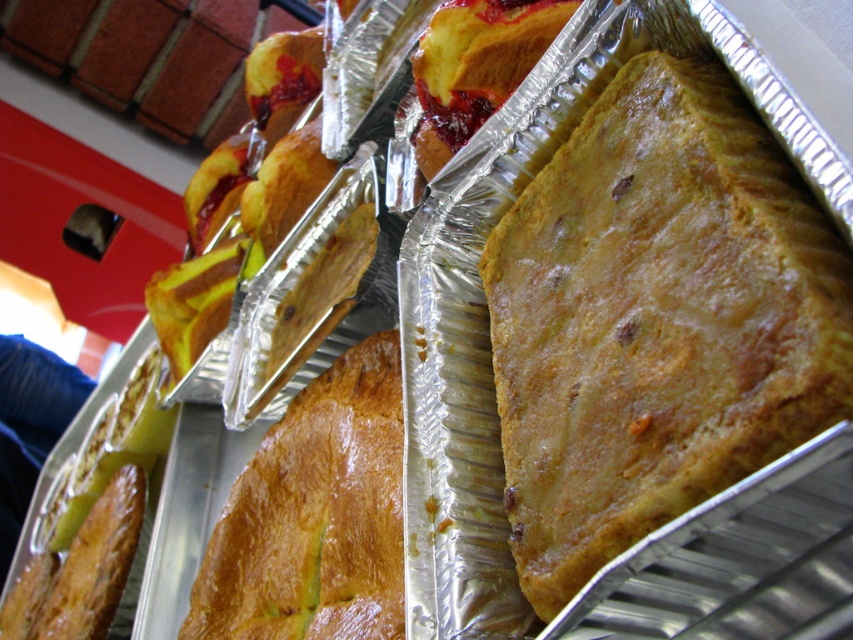
Question: Which point is closer to the camera?

Choices:
 (A) (329, 417)
 (B) (830, 424)

Answer: (B)

Question: Which object is farther from the camera taking this photo?

Choices:
 (A) golden brown crusty bread at center
 (B) golden brown flaky pastry at center

Answer: (A)

Question: Is golden brown flaky pastry at center above golden brown crusty bread at center?

Choices:
 (A) no
 (B) yes

Answer: (B)

Question: Considering the relative positions of golden brown flaky pastry at center and golden brown crusty bread at center in the image provided, where is golden brown flaky pastry at center located with respect to golden brown crusty bread at center?

Choices:
 (A) right
 (B) left

Answer: (A)

Question: Can you confirm if golden brown flaky pastry at center is thinner than golden brown crusty bread at center?

Choices:
 (A) yes
 (B) no

Answer: (A)